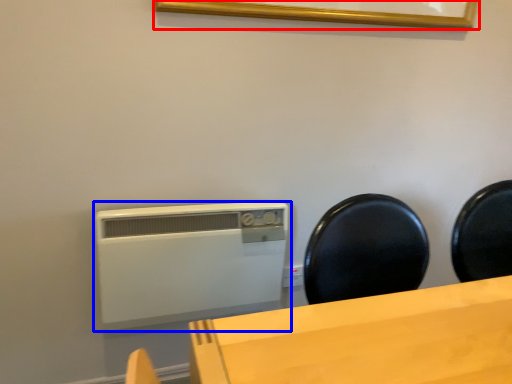
Question: Which point is further to the camera, picture frame (highlighted by a red box) or home appliance (highlighted by a blue box)?

Choices:
 (A) picture frame
 (B) home appliance

Answer: (B)